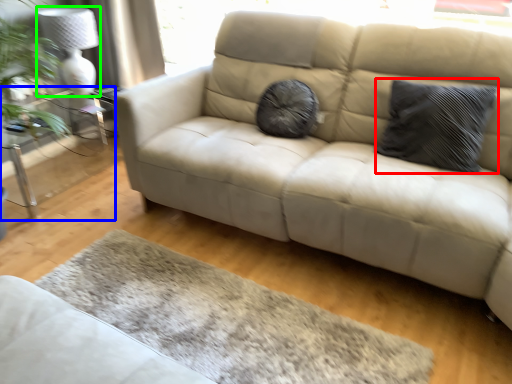
Question: Based on their relative distances, which object is nearer to pillow (highlighted by a red box)? Choose from table (highlighted by a blue box) and lamp (highlighted by a green box).

Choices:
 (A) table
 (B) lamp

Answer: (B)